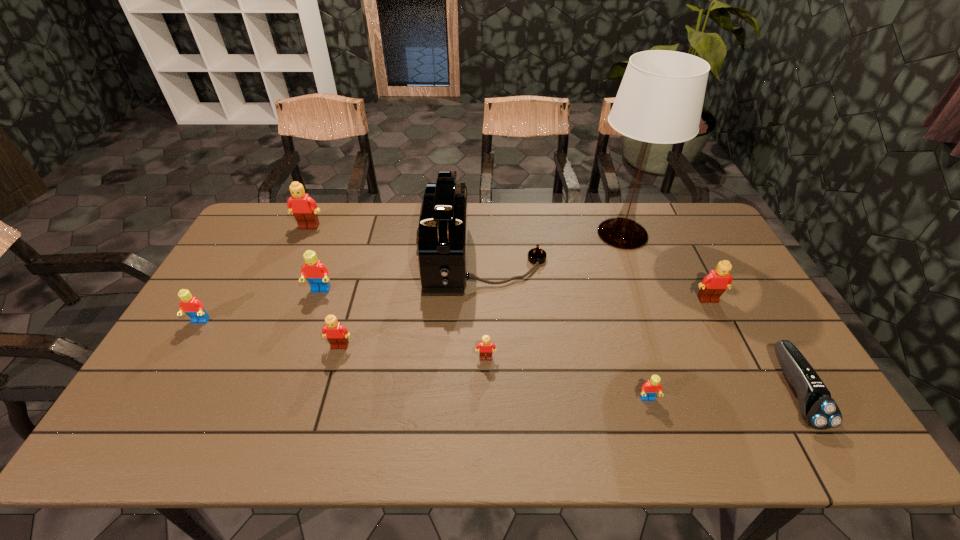
I want to click on the fourth Lego from left to right, so click(336, 334).

Locate an element on the screen. This screenshot has height=540, width=960. the third biggest brown Lego is located at coordinates (336, 334).

You are a GUI agent. You are given a task and a screenshot of the screen. Output one action in this format:
    pyautogui.click(x=<x>, y=<y>)
    Task: Click on the smallest red Lego
    This screenshot has width=960, height=540.
    Given the screenshot: What is the action you would take?
    pyautogui.click(x=652, y=387)

Locate an element on the screen. Image resolution: width=960 pixels, height=540 pixels. the nearest Lego is located at coordinates [x=652, y=387].

Find the location of a particular element. The width and height of the screenshot is (960, 540). the nearest brown Lego is located at coordinates (485, 350).

You are a GUI agent. You are given a task and a screenshot of the screen. Output one action in this format:
    pyautogui.click(x=<x>, y=<y>)
    Task: Click on the third Lego from right to left
    This screenshot has width=960, height=540.
    Given the screenshot: What is the action you would take?
    [x=485, y=350]

Find the location of a particular element. Image resolution: width=960 pixels, height=540 pixels. the rightmost object is located at coordinates (818, 408).

Image resolution: width=960 pixels, height=540 pixels. Find the location of `free point located above the cylindrical shade of the tallest object`. free point located above the cylindrical shade of the tallest object is located at coordinates pos(645,295).

At what (x,y) coordinates should I click in order to perform the action: click on free space located 0.330m on the front-facing side of the second tallest object. Please return your answer as a coordinate pair (x, y). This screenshot has height=540, width=960. Looking at the image, I should click on (323, 261).

Locate an element on the screen. The height and width of the screenshot is (540, 960). free space located on the front-facing side of the second tallest object is located at coordinates (325, 261).